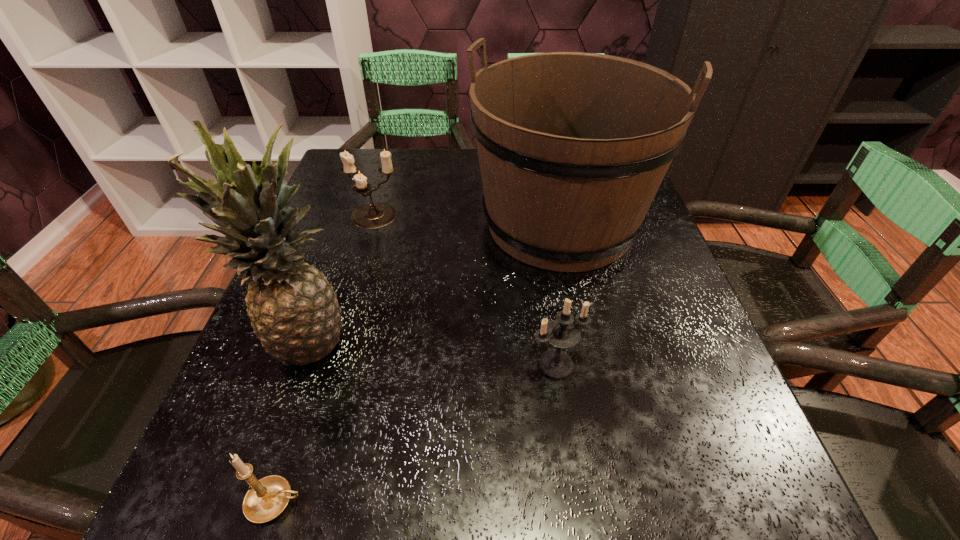
Find the location of `vacant space at the near left corner of the desktop`. vacant space at the near left corner of the desktop is located at coordinates (181, 535).

Find the location of `empty space between the rightmost candle holder and the pineapple`. empty space between the rightmost candle holder and the pineapple is located at coordinates (430, 352).

Image resolution: width=960 pixels, height=540 pixels. What are the coordinates of `free space between the bucket and the pineapple` in the screenshot? It's located at (432, 282).

Identify the location of free point between the nearest candle holder and the second nearest candle holder. This screenshot has height=540, width=960. (416, 433).

Locate an element on the screen. This screenshot has height=540, width=960. free spot between the second farthest candle holder and the bucket is located at coordinates (558, 294).

Identify the location of free area in between the nearest candle holder and the second nearest candle holder. (416, 433).

Find the location of `vacant point located between the bucket and the nearest candle holder`. vacant point located between the bucket and the nearest candle holder is located at coordinates (418, 363).

Identify the location of vacant space that's between the pineapple and the rightmost candle holder. (430, 352).

Locate an element on the screen. The width and height of the screenshot is (960, 540). vacant area between the nearest candle holder and the bucket is located at coordinates (418, 363).

Where is `unoccupied area between the pineapple and the nearest object`? The image size is (960, 540). unoccupied area between the pineapple and the nearest object is located at coordinates (290, 421).